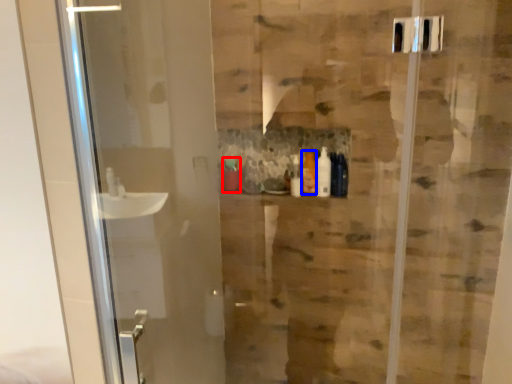
Question: Among these objects, which one is farthest to the camera, toiletry (highlighted by a red box) or toiletry (highlighted by a blue box)?

Choices:
 (A) toiletry
 (B) toiletry

Answer: (A)